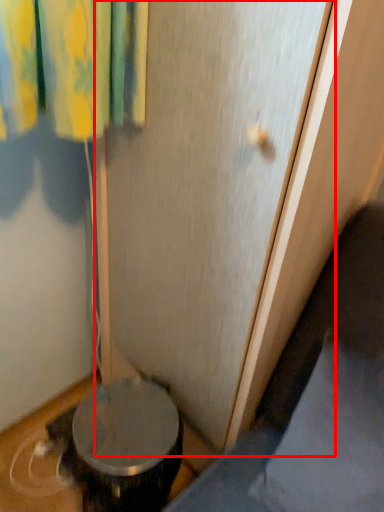
Question: From the image's perspective, what is the correct spatial positioning of screen door (annotated by the red box) in reference to pillow?

Choices:
 (A) above
 (B) below

Answer: (A)